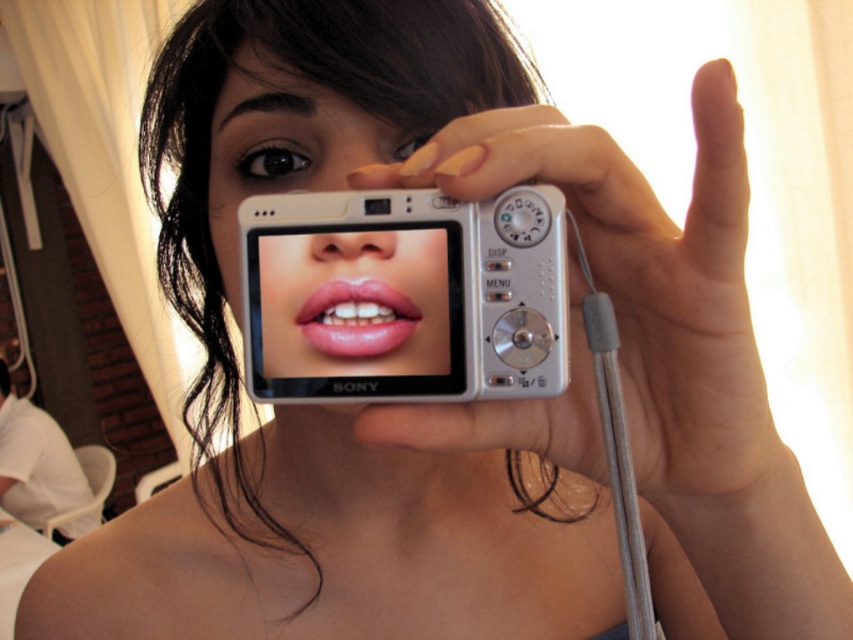
Question: Can you confirm if white fabric at lower left is positioned below pink glossy lips at center?

Choices:
 (A) yes
 (B) no

Answer: (A)

Question: Is white plastic camera at center smaller than white fabric at lower left?

Choices:
 (A) no
 (B) yes

Answer: (B)

Question: Is silver metallic camera at center behind pink glossy lips at center?

Choices:
 (A) yes
 (B) no

Answer: (B)

Question: Among these objects, which one is nearest to the camera?

Choices:
 (A) white plastic camera at center
 (B) white fabric at lower left
 (C) pink glossy lips at center

Answer: (A)

Question: Which point is closer to the camera?

Choices:
 (A) (543, 433)
 (B) (434, 337)

Answer: (B)

Question: Which object appears farthest from the camera in this image?

Choices:
 (A) matte white camera at center
 (B) white fabric at lower left

Answer: (B)